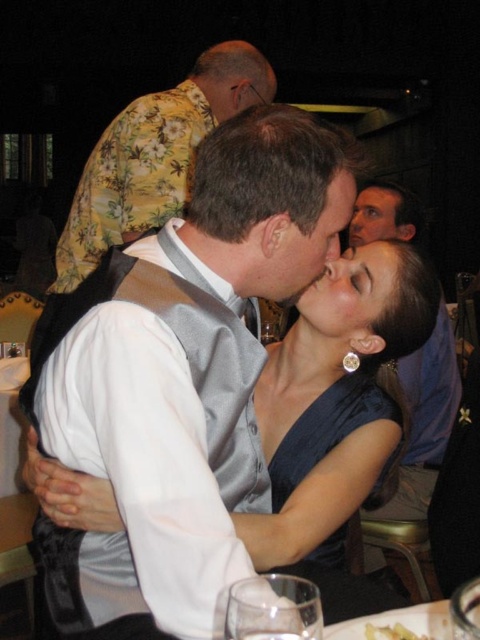
Question: Which point is farther to the camera?

Choices:
 (A) (371, 634)
 (B) (445, 308)
 (C) (385, 250)
 (D) (173, 176)

Answer: (B)

Question: Can you confirm if matte blue dress at center is wider than clear glass at center?

Choices:
 (A) no
 (B) yes

Answer: (B)

Question: Is smooth skin face at center further to camera compared to clear glass at center?

Choices:
 (A) no
 (B) yes

Answer: (B)

Question: Which point is closer to the camera?

Choices:
 (A) (297, 608)
 (B) (408, 636)
 (C) (355, 317)
 (D) (364, 218)

Answer: (A)

Question: Does clear glass at lower center lie in front of smooth skin face at center?

Choices:
 (A) yes
 (B) no

Answer: (A)

Question: Among these objects, which one is farthest from the camera?

Choices:
 (A) smooth skin face at center
 (B) matte blue shirt at right
 (C) satin blue dress at center

Answer: (B)